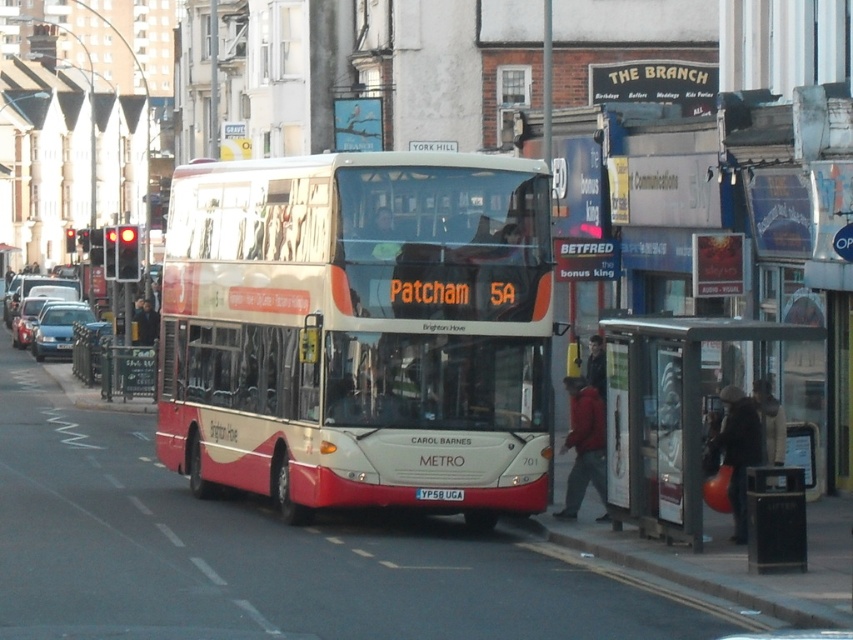
Question: Which point appears closest to the camera in this image?

Choices:
 (A) (65, 317)
 (B) (22, 300)
 (C) (809, 346)

Answer: (C)

Question: Is white glossy bus at center to the right of yellow matte license plate at center from the viewer's perspective?

Choices:
 (A) yes
 (B) no

Answer: (B)

Question: Considering the real-world distances, which object is closest to the yellow matte license plate at center?

Choices:
 (A) metallic bus stop at lower right
 (B) white glossy bus at center
 (C) matte blue sedan at left
 (D) metallic silver car at center-left

Answer: (B)

Question: Is metallic bus stop at lower right smaller than yellow matte license plate at center?

Choices:
 (A) no
 (B) yes

Answer: (A)

Question: Is metallic bus stop at lower right behind yellow matte license plate at center?

Choices:
 (A) yes
 (B) no

Answer: (A)

Question: Which object is positioned closest to the white glossy bus at center?

Choices:
 (A) metallic bus stop at lower right
 (B) metallic silver car at center-left
 (C) yellow matte license plate at center
 (D) matte blue sedan at left

Answer: (C)